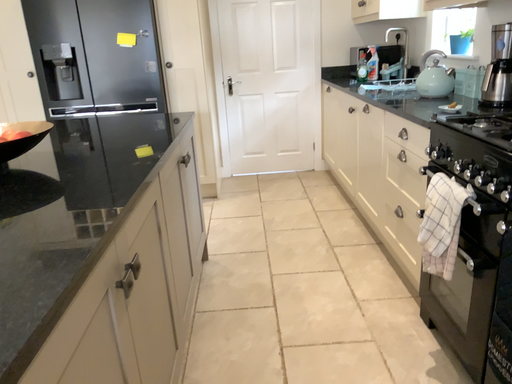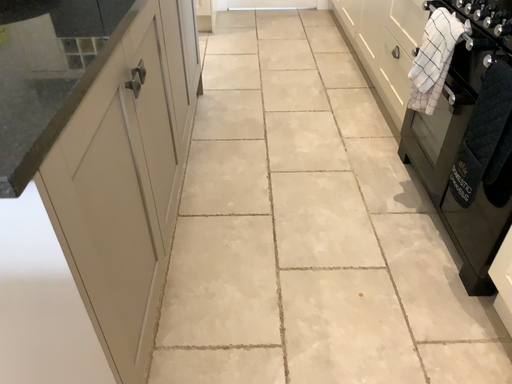
Question: Which way did the camera rotate in the video?

Choices:
 (A) rotated downward
 (B) rotated upward

Answer: (A)